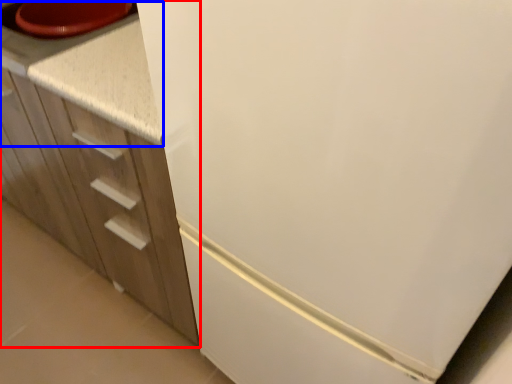
Question: Which point is closer to the camera, cabinetry (highlighted by a red box) or counter top (highlighted by a blue box)?

Choices:
 (A) cabinetry
 (B) counter top

Answer: (A)